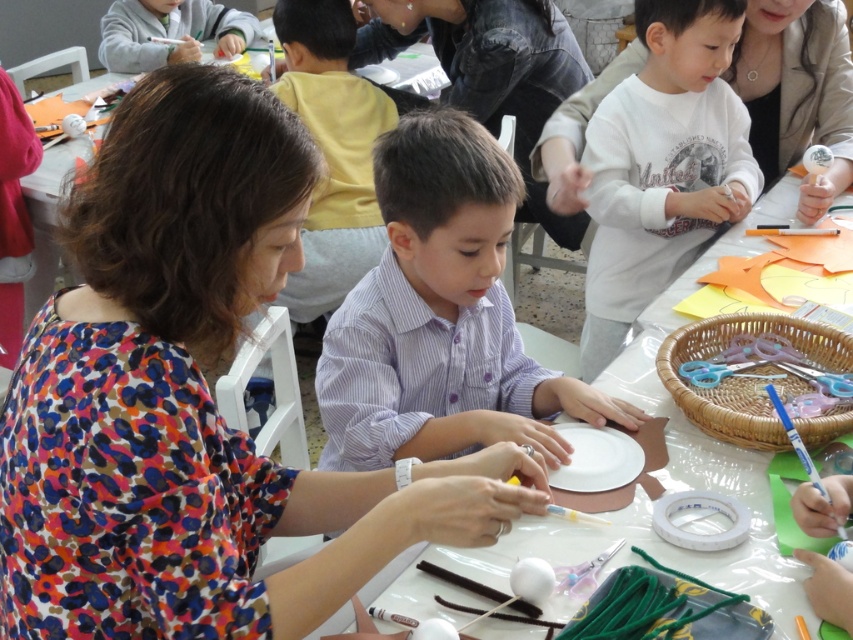
Can you confirm if white paper plate at center is positioned above matte black shirt at upper center?

No, white paper plate at center is not above matte black shirt at upper center.

Is white paper plate at center shorter than matte black shirt at upper center?

Correct, white paper plate at center is not as tall as matte black shirt at upper center.

Is point (737, 477) positioned behind point (497, 16)?

No, (737, 477) is closer to viewer.

This screenshot has width=853, height=640. In order to click on white paper plate at center in this screenshot , I will do `click(711, 444)`.

Measure the distance between white striped shirt at center and white paper plate at center.

The distance of white striped shirt at center from white paper plate at center is 13.94 inches.

Who is positioned more to the right, white striped shirt at center or white paper plate at center?

From the viewer's perspective, white paper plate at center appears more on the right side.

Which is in front, point (370, 269) or point (637, 538)?

Positioned in front is point (637, 538).

Identify the location of white striped shirt at center. (440, 316).

Is white cotton shirt at upper center wider than matte black shirt at upper center?

Incorrect, white cotton shirt at upper center's width does not surpass matte black shirt at upper center's.

Who is lower down, white cotton shirt at upper center or matte black shirt at upper center?

white cotton shirt at upper center

Is point (624, 284) behind point (396, 33)?

No, it is in front of (396, 33).

Locate an element on the screen. This screenshot has width=853, height=640. white cotton shirt at upper center is located at coordinates (662, 164).